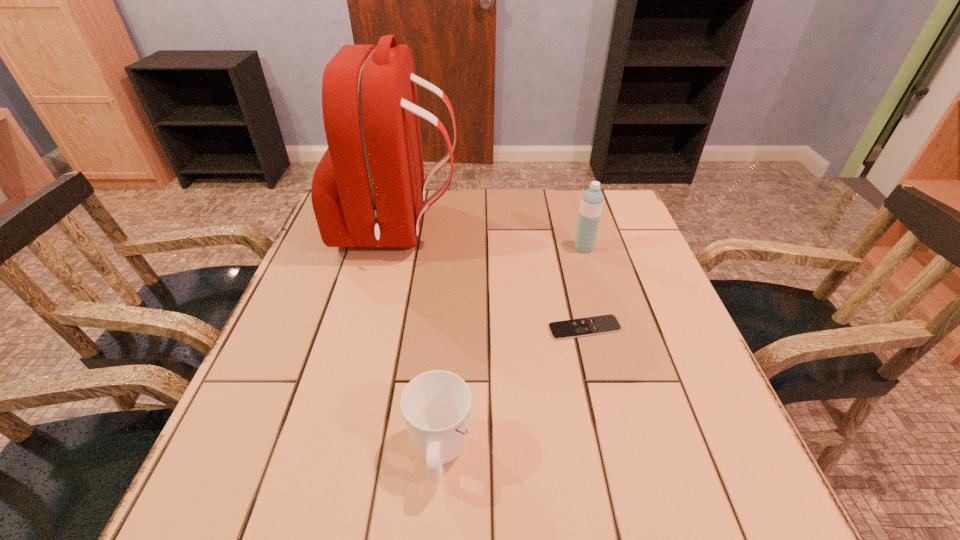
Locate an element on the screen. free space between the nearest object and the second tallest object is located at coordinates (512, 350).

The width and height of the screenshot is (960, 540). Find the location of `vacant area that lies between the nearest object and the backpack`. vacant area that lies between the nearest object and the backpack is located at coordinates (420, 341).

Where is `free spot between the water bottle and the backpack`? This screenshot has width=960, height=540. free spot between the water bottle and the backpack is located at coordinates 492,239.

This screenshot has height=540, width=960. I want to click on vacant point located between the third farthest object and the nearest object, so click(512, 391).

Locate an element on the screen. This screenshot has height=540, width=960. free space between the water bottle and the tallest object is located at coordinates (492, 239).

You are a GUI agent. You are given a task and a screenshot of the screen. Output one action in this format:
    pyautogui.click(x=<x>, y=<y>)
    Task: Click on the closest object to the mug
    The width and height of the screenshot is (960, 540).
    Given the screenshot: What is the action you would take?
    pyautogui.click(x=602, y=324)

Point out which object is positioned as the third nearest to the water bottle. Please provide its 2D coordinates. Your answer should be formatted as a tuple, i.e. [(x, y)], where the tuple contains the x and y coordinates of a point satisfying the conditions above.

[(436, 405)]

Find the location of `free space that satisfies the following two spatial constraints: 1. on the strap side of the third shortest object; 2. on the left side of the tallest object`. free space that satisfies the following two spatial constraints: 1. on the strap side of the third shortest object; 2. on the left side of the tallest object is located at coordinates (395, 248).

Locate an element on the screen. The width and height of the screenshot is (960, 540). vacant space that satisfies the following two spatial constraints: 1. on the back side of the remote control; 2. on the strap side of the backpack is located at coordinates (561, 230).

At what (x,y) coordinates should I click in order to perform the action: click on vacant space that satisfies the following two spatial constraints: 1. on the side of the shortest object with the handle; 2. on the right side of the second shortest object. Please return your answer as a coordinate pair (x, y). Looking at the image, I should click on pyautogui.click(x=449, y=328).